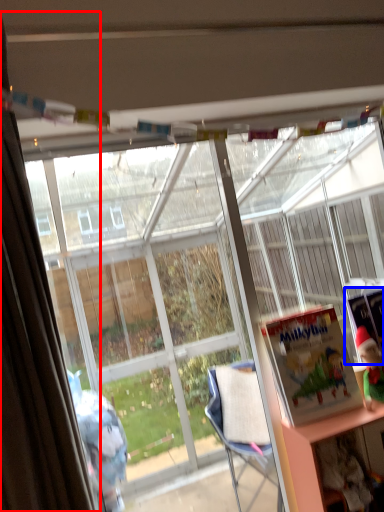
Question: Which object is further to the camera taking this photo, curtain (highlighted by a red box) or book (highlighted by a blue box)?

Choices:
 (A) curtain
 (B) book

Answer: (B)